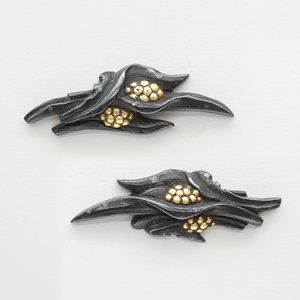
What are the coordinates of `space below figurines` in the screenshot? It's located at (176, 240), (124, 136).